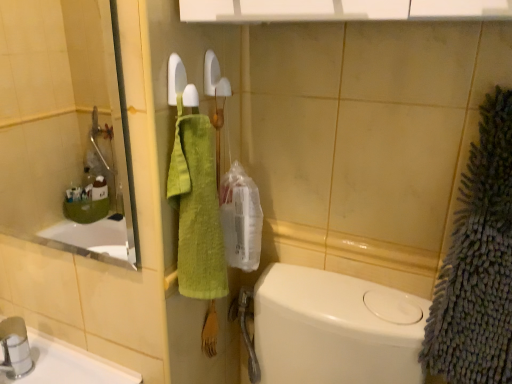
Question: Is green cotton towel at center, the 1th bath towel in the left-to-right sequence, directly adjacent to clear glass mirror at upper left?

Choices:
 (A) yes
 (B) no

Answer: (B)

Question: Considering the relative sizes of green cotton towel at center, the 1th bath towel in the left-to-right sequence, and clear glass mirror at upper left in the image provided, is green cotton towel at center, the 1th bath towel in the left-to-right sequence, wider than clear glass mirror at upper left?

Choices:
 (A) yes
 (B) no

Answer: (A)

Question: Can you confirm if green cotton towel at center, which appears as the 2th bath towel when viewed from the right, is smaller than clear glass mirror at upper left?

Choices:
 (A) no
 (B) yes

Answer: (B)

Question: Does green cotton towel at center, which appears as the 2th bath towel when viewed from the right, have a larger size compared to clear glass mirror at upper left?

Choices:
 (A) no
 (B) yes

Answer: (A)

Question: Is clear glass mirror at upper left completely or partially inside green cotton towel at center, the 1th bath towel in the left-to-right sequence?

Choices:
 (A) yes
 (B) no

Answer: (B)

Question: Is green cotton towel at center, which appears as the 2th bath towel when viewed from the right, positioned before clear glass mirror at upper left?

Choices:
 (A) no
 (B) yes

Answer: (A)

Question: From the image's perspective, is green cotton towel at center, which appears as the 2th bath towel when viewed from the right, beneath gray fuzzy bath towel at right, which is counted as the 2th bath towel, starting from the left?

Choices:
 (A) no
 (B) yes

Answer: (A)

Question: Is gray fuzzy bath towel at right, arranged as the first bath towel when viewed from the right, at the back of green cotton towel at center, the 1th bath towel in the left-to-right sequence?

Choices:
 (A) no
 (B) yes

Answer: (A)

Question: Can you confirm if green cotton towel at center, which appears as the 2th bath towel when viewed from the right, is positioned to the right of gray fuzzy bath towel at right, which is counted as the 2th bath towel, starting from the left?

Choices:
 (A) yes
 (B) no

Answer: (B)

Question: From the image's perspective, is green cotton towel at center, the 1th bath towel in the left-to-right sequence, on top of gray fuzzy bath towel at right, which is counted as the 2th bath towel, starting from the left?

Choices:
 (A) no
 (B) yes

Answer: (B)

Question: Does green cotton towel at center, the 1th bath towel in the left-to-right sequence, have a lesser height compared to gray fuzzy bath towel at right, which is counted as the 2th bath towel, starting from the left?

Choices:
 (A) no
 (B) yes

Answer: (B)

Question: Can you confirm if green cotton towel at center, which appears as the 2th bath towel when viewed from the right, is bigger than gray fuzzy bath towel at right, which is counted as the 2th bath towel, starting from the left?

Choices:
 (A) no
 (B) yes

Answer: (A)

Question: From the image's perspective, is clear glass mirror at upper left below gray fuzzy bath towel at right, arranged as the first bath towel when viewed from the right?

Choices:
 (A) no
 (B) yes

Answer: (A)